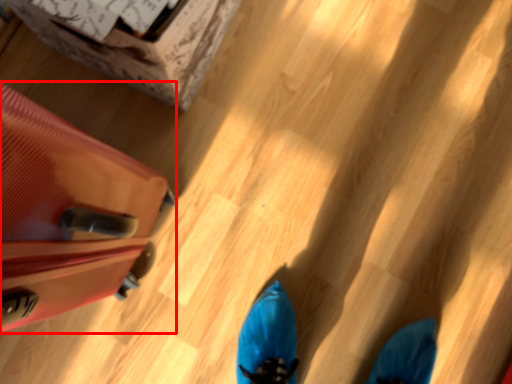
Question: From the image's perspective, where is luggage (annotated by the red box) located relative to cardboard box?

Choices:
 (A) below
 (B) above

Answer: (A)